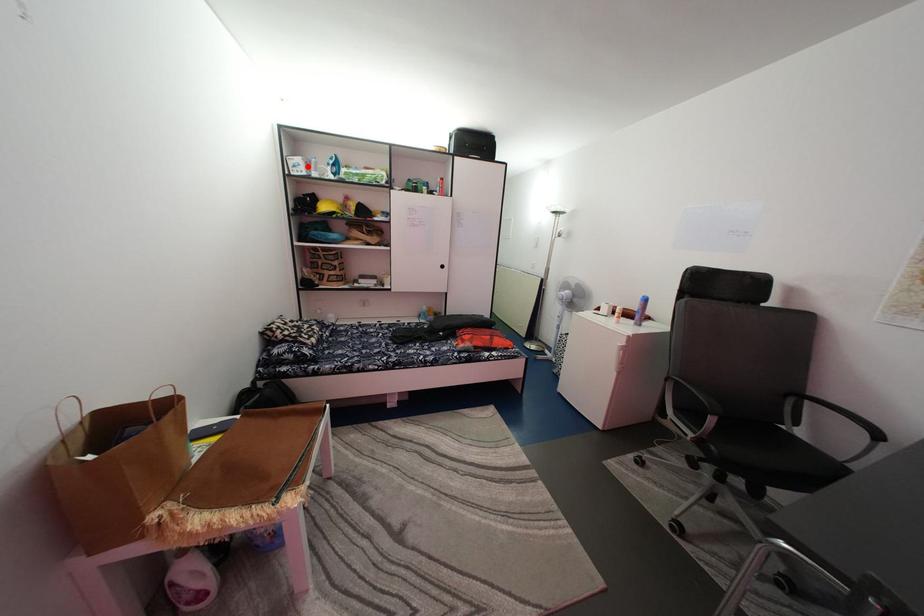
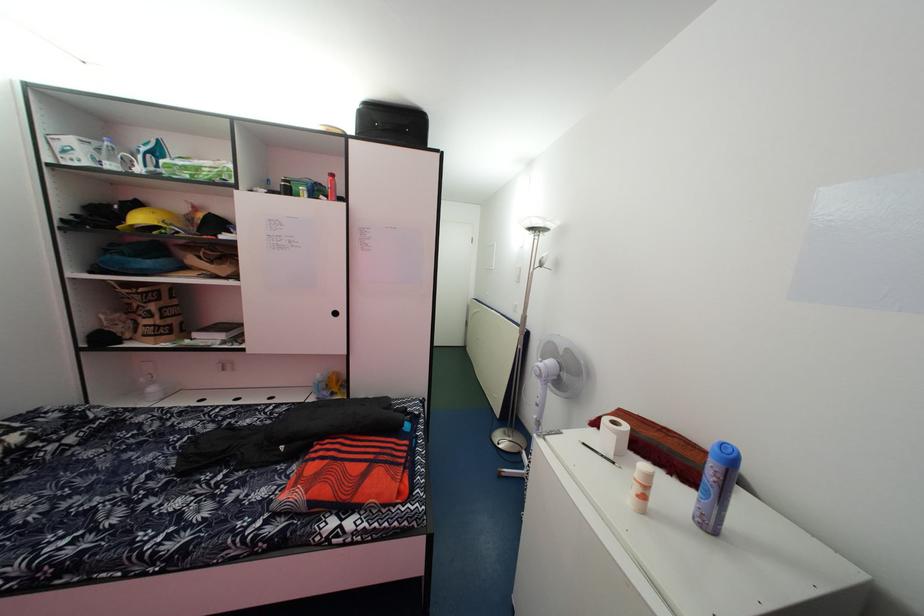
Question: A red point is marked in image1. In image2, is the corresponding 3D point closer to the camera or farther? Reply with the corresponding letter.

Choices:
 (A) The corresponding 3D point is closer.
 (B) The corresponding 3D point is farther.

Answer: (B)